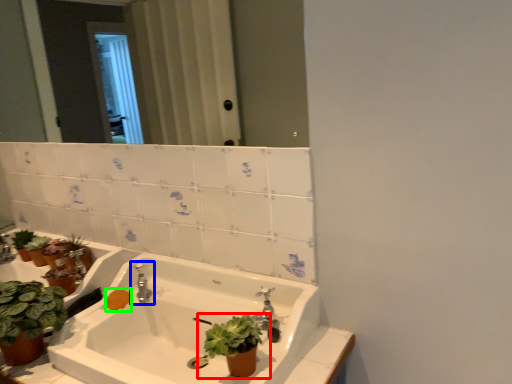
Question: Estimate the real-world distances between objects in this image. Which object is farther from houseplant (highlighted by a red box), tap (highlighted by a blue box) or soap (highlighted by a green box)?

Choices:
 (A) tap
 (B) soap

Answer: (B)